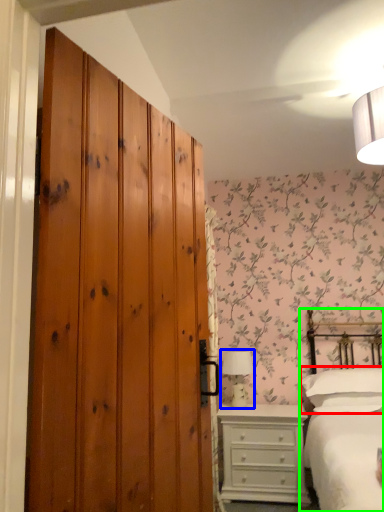
Question: Based on their relative distances, which object is nearer to pillow (highlighted by a red box)? Choose from table lamp (highlighted by a blue box) and bed (highlighted by a green box).

Choices:
 (A) table lamp
 (B) bed

Answer: (B)